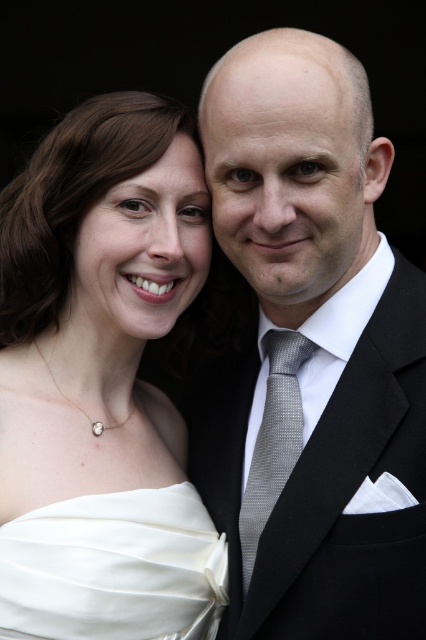
Does white satin dress at left appear on the left side of satin white dress at lower left?

Correct, you'll find white satin dress at left to the left of satin white dress at lower left.

Which is more to the left, white satin dress at left or satin white dress at lower left?

From the viewer's perspective, white satin dress at left appears more on the left side.

Is point (57, 630) closer to camera compared to point (114, 563)?

Yes, point (57, 630) is in front of point (114, 563).

Identify the location of white satin dress at left. This screenshot has width=426, height=640. (101, 381).

Between point (419, 490) and point (2, 604), which one is positioned behind?

Point (2, 604)

Based on the photo, between matte silver tie at center and satin white dress at lower left, which one appears on the right side from the viewer's perspective?

matte silver tie at center

Does point (328, 472) come behind point (69, 508)?

That is False.

The image size is (426, 640). What are the coordinates of `matte silver tie at center` in the screenshot? It's located at (311, 355).

Between satin white dress at lower left and silver textured tie at center, which one has less height?

Standing shorter between the two is satin white dress at lower left.

Find the location of a particular element. This screenshot has width=426, height=640. satin white dress at lower left is located at coordinates (114, 568).

Is point (172, 576) farther from camera compared to point (281, 452)?

No, it is not.

In order to click on satin white dress at lower left in this screenshot , I will do `click(114, 568)`.